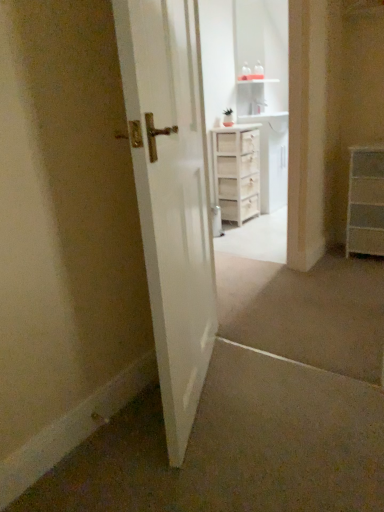
Where is `white wood cabinet at center`? The height and width of the screenshot is (512, 384). white wood cabinet at center is located at coordinates (272, 158).

You are a GUI agent. You are given a task and a screenshot of the screen. Output one action in this format:
    pyautogui.click(x=<x>, y=<y>)
    Task: Click on the white wood cabinet at upper center
    This screenshot has width=384, height=512.
    Given the screenshot: What is the action you would take?
    click(x=250, y=106)

At what (x,y) coordinates should I click in order to perform the action: click on white wood cabinet at center. Please return your answer as a coordinate pair (x, y). The image size is (384, 512). Looking at the image, I should click on (272, 158).

Can you confirm if white wood cabinet at upper center is taller than white wooden chest of drawers at center, which is the first chest of drawers from back to front?

Yes.

Is white wood cabinet at upper center touching white wooden chest of drawers at center, acting as the second chest of drawers starting from the right?

No, white wood cabinet at upper center is not touching white wooden chest of drawers at center, acting as the second chest of drawers starting from the right.

Considering the positions of point (249, 65) and point (244, 195), is point (249, 65) closer or farther from the camera than point (244, 195)?

Point (249, 65) appears to be farther away from the viewer than point (244, 195).

Does white wooden chest of drawers at center, which is the first chest of drawers from back to front, have a smaller size compared to white wood cabinet at upper center?

No, white wooden chest of drawers at center, which is the first chest of drawers from back to front, is not smaller than white wood cabinet at upper center.

You are a GUI agent. You are given a task and a screenshot of the screen. Output one action in this format:
    pyautogui.click(x=<x>, y=<y>)
    Task: Click on the 2nd chest of drawers behind the white wood cabinet at upper center, starting your count from the anchor
    This screenshot has height=512, width=384.
    Given the screenshot: What is the action you would take?
    pyautogui.click(x=237, y=170)

Is white wooden chest of drawers at center, which is the first chest of drawers in left-to-right order, beside white wood cabinet at upper center?

No, white wooden chest of drawers at center, which is the first chest of drawers in left-to-right order, is not touching white wood cabinet at upper center.

Is white wooden chest of drawers at center, acting as the second chest of drawers starting from the right, facing away from white wood cabinet at upper center?

No, white wooden chest of drawers at center, acting as the second chest of drawers starting from the right,'s orientation is not away from white wood cabinet at upper center.

From the image's perspective, is white matte chest of drawers at right, which is the first chest of drawers in front-to-back order, above or below white glossy door at center?

From the image's perspective, white matte chest of drawers at right, which is the first chest of drawers in front-to-back order, appears above white glossy door at center.

How much distance is there between white matte chest of drawers at right, the second chest of drawers from the left, and white glossy door at center?

white matte chest of drawers at right, the second chest of drawers from the left, is 1.48 meters from white glossy door at center.

Considering the relative sizes of white matte chest of drawers at right, which appears as the 1th chest of drawers when viewed from the right, and white glossy door at center in the image provided, is white matte chest of drawers at right, which appears as the 1th chest of drawers when viewed from the right, taller than white glossy door at center?

No.

From a real-world perspective, is white matte chest of drawers at right, which is the first chest of drawers in front-to-back order, beneath white glossy door at center?

Yes, from a real-world perspective, white matte chest of drawers at right, which is the first chest of drawers in front-to-back order, is beneath white glossy door at center.

Who is taller, white matte chest of drawers at right, which is the first chest of drawers in front-to-back order, or white wood cabinet at upper center?

With more height is white wood cabinet at upper center.

Is white matte chest of drawers at right, which is the first chest of drawers in front-to-back order, aimed at white wood cabinet at upper center?

No, white matte chest of drawers at right, which is the first chest of drawers in front-to-back order, is not facing towards white wood cabinet at upper center.

From the image's perspective, which one is positioned higher, white matte chest of drawers at right, the second chest of drawers from the left, or white wood cabinet at upper center?

white wood cabinet at upper center is shown above in the image.

What's the angular difference between white matte chest of drawers at right, the second chest of drawers from the left, and white wood cabinet at upper center's facing directions?

0.0157 degrees.

From the image's perspective, does white glossy door at center appear lower than white wooden chest of drawers at center, which is the first chest of drawers from back to front?

Indeed, from the image's perspective, white glossy door at center is shown beneath white wooden chest of drawers at center, which is the first chest of drawers from back to front.

Can you confirm if white glossy door at center is wider than white wooden chest of drawers at center, placed as the second chest of drawers when sorted from front to back?

Incorrect, the width of white glossy door at center does not surpass that of white wooden chest of drawers at center, placed as the second chest of drawers when sorted from front to back.

Does white glossy door at center appear on the right side of white wooden chest of drawers at center, acting as the second chest of drawers starting from the right?

No.

Where is `door above the white wooden chest of drawers at center, which is the first chest of drawers from back to front (from a real-world perspective)`? The height and width of the screenshot is (512, 384). door above the white wooden chest of drawers at center, which is the first chest of drawers from back to front (from a real-world perspective) is located at coordinates (171, 197).

Can we say white matte chest of drawers at right, which is the first chest of drawers in front-to-back order, lies outside white wood cabinet at center?

Indeed, white matte chest of drawers at right, which is the first chest of drawers in front-to-back order, is completely outside white wood cabinet at center.

Is point (352, 240) positioned behind point (271, 184)?

No, (352, 240) is in front of (271, 184).

Which of these two, white matte chest of drawers at right, which is the first chest of drawers in front-to-back order, or white wood cabinet at center, is bigger?

white wood cabinet at center.

From a real-world perspective, is white matte chest of drawers at right, which appears as the 1th chest of drawers when viewed from the right, physically above white wood cabinet at center?

No, from a real-world perspective, white matte chest of drawers at right, which appears as the 1th chest of drawers when viewed from the right, is not over white wood cabinet at center

From the image's perspective, would you say white wood cabinet at upper center is positioned over white glossy door at center?

Yes, from the image's perspective, white wood cabinet at upper center is over white glossy door at center.

Does point (238, 37) come closer to viewer compared to point (152, 35)?

That is False.

Which of these two, white wood cabinet at upper center or white glossy door at center, stands taller?

With more height is white wood cabinet at upper center.

Image resolution: width=384 pixels, height=512 pixels. What are the coordinates of `entertainment center on the left of white wooden chest of drawers at center, placed as the second chest of drawers when sorted from front to back` in the screenshot? It's located at (250, 106).

I want to click on entertainment center positioned vertically above the white wooden chest of drawers at center, acting as the second chest of drawers starting from the right (from a real-world perspective), so click(250, 106).

Based on the photo, estimate the real-world distances between objects in this image. Which object is closer to white wooden chest of drawers at center, placed as the second chest of drawers when sorted from front to back, white wood cabinet at center or white glossy door at center?

Based on the image, white wood cabinet at center appears to be nearer to white wooden chest of drawers at center, placed as the second chest of drawers when sorted from front to back.

When comparing their distances from white wooden chest of drawers at center, placed as the second chest of drawers when sorted from front to back, does white glossy door at center or white matte chest of drawers at right, placed as the 2th chest of drawers when sorted from back to front, seem further?

Among the two, white glossy door at center is located further to white wooden chest of drawers at center, placed as the second chest of drawers when sorted from front to back.

When comparing their distances from white matte chest of drawers at right, the second chest of drawers from the left, does white glossy door at center or white wood cabinet at upper center seem further?

white glossy door at center is further to white matte chest of drawers at right, the second chest of drawers from the left.

Estimate the real-world distances between objects in this image. Which object is further from white wooden chest of drawers at center, acting as the second chest of drawers starting from the right, white wood cabinet at center or white matte chest of drawers at right, which is the first chest of drawers in front-to-back order?

white matte chest of drawers at right, which is the first chest of drawers in front-to-back order, is positioned further to the anchor white wooden chest of drawers at center, acting as the second chest of drawers starting from the right.

When comparing their distances from white wooden chest of drawers at center, which is the first chest of drawers in left-to-right order, does white matte chest of drawers at right, which is the first chest of drawers in front-to-back order, or white glossy door at center seem further?

white glossy door at center.

When comparing their distances from white wooden chest of drawers at center, which is the first chest of drawers from back to front, does white wood cabinet at center or white wood cabinet at upper center seem further?

white wood cabinet at upper center is further to white wooden chest of drawers at center, which is the first chest of drawers from back to front.

Estimate the real-world distances between objects in this image. Which object is further from white glossy door at center, white wooden chest of drawers at center, acting as the second chest of drawers starting from the right, or white wood cabinet at center?

Among the two, white wood cabinet at center is located further to white glossy door at center.

From the image, which object appears to be nearer to white wood cabinet at center, white wooden chest of drawers at center, which is the first chest of drawers in left-to-right order, or white wood cabinet at upper center?

The object closer to white wood cabinet at center is white wooden chest of drawers at center, which is the first chest of drawers in left-to-right order.

Find the location of a particular element. entertainment center located between white glossy door at center and white matte chest of drawers at right, which appears as the 1th chest of drawers when viewed from the right, in the depth direction is located at coordinates (250, 106).

Locate an element on the screen. the chest of drawers located between white glossy door at center and white wooden chest of drawers at center, which is the first chest of drawers from back to front, in the depth direction is located at coordinates (365, 202).

The width and height of the screenshot is (384, 512). I want to click on entertainment center positioned between white glossy door at center and white wooden chest of drawers at center, which is the first chest of drawers in left-to-right order, from near to far, so click(x=250, y=106).

Find the location of a particular element. Image resolution: width=384 pixels, height=512 pixels. the chest of drawers positioned between white wood cabinet at upper center and white wooden chest of drawers at center, acting as the second chest of drawers starting from the right, from near to far is located at coordinates (365, 202).